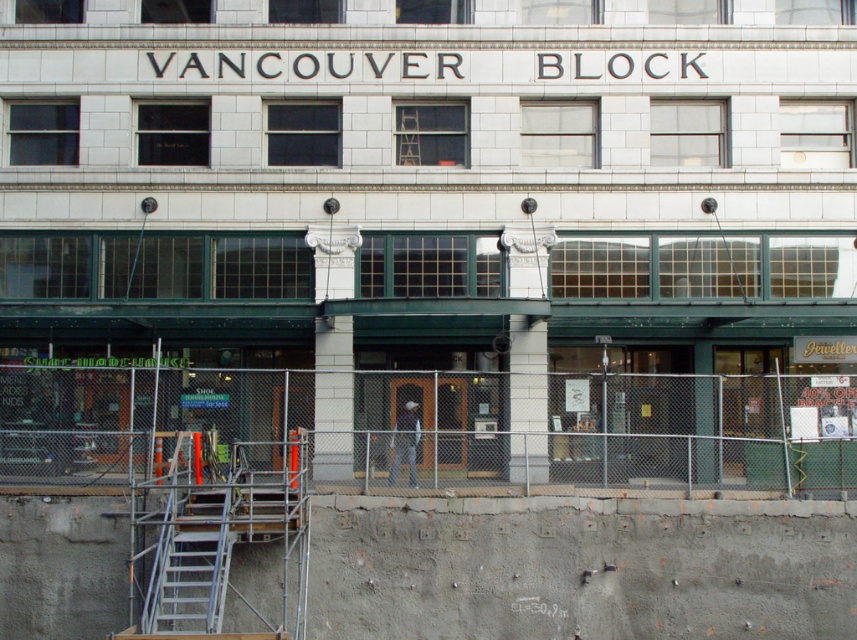
You are standing in front of the Vancouver Block building and want to take a photo of the building name. You notice two points marked on your map at coordinates point (550,376) and point (399,456). Which point is closer to you?

Point (399,456) is closer to you because it is less further to the camera than point (550,376).